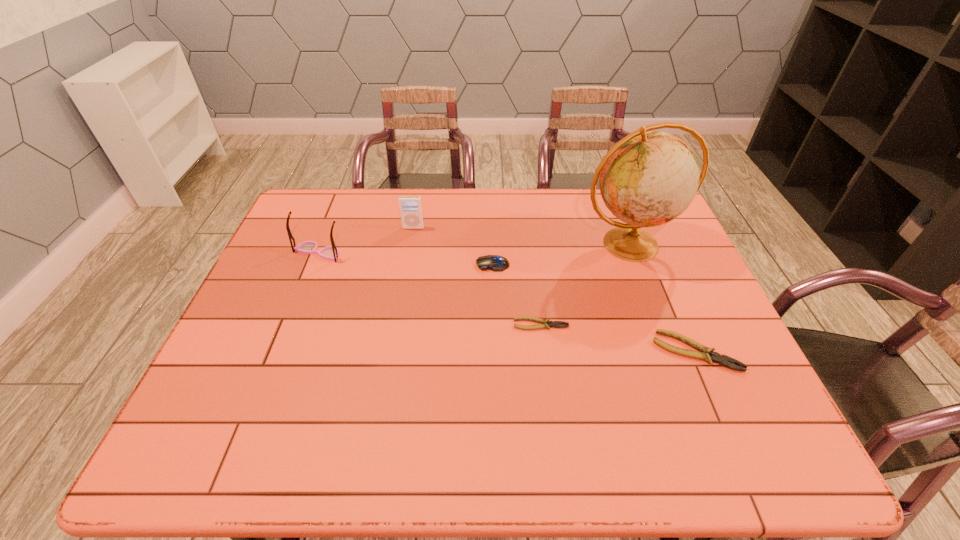
Identify the location of free area in between the computer mouse and the nearest object. The height and width of the screenshot is (540, 960). [x=594, y=308].

This screenshot has height=540, width=960. Identify the location of vacant space that is in between the third shortest object and the leftmost object. (406, 259).

Locate an element on the screen. This screenshot has width=960, height=540. free point between the fifth object from right to left and the shorter pliers is located at coordinates (477, 276).

Where is `free space that is in between the iPod and the computer mouse`? free space that is in between the iPod and the computer mouse is located at coordinates (453, 246).

At what (x,y) coordinates should I click in order to perform the action: click on free space between the taller pliers and the tallest object. Please return your answer as a coordinate pair (x, y). The width and height of the screenshot is (960, 540). Looking at the image, I should click on (663, 298).

At what (x,y) coordinates should I click in order to perform the action: click on object that stands as the fifth closest to the second object from left to right. Please return your answer as a coordinate pair (x, y). Image resolution: width=960 pixels, height=540 pixels. Looking at the image, I should click on (705, 352).

Identify the location of object that is the fifth closest one to the spectacles. (705, 352).

Where is `vacant space that satisfies the following two spatial constraints: 1. on the back side of the fifth farthest object; 2. on the left side of the tallest object`? vacant space that satisfies the following two spatial constraints: 1. on the back side of the fifth farthest object; 2. on the left side of the tallest object is located at coordinates (531, 245).

Find the location of `free location that satisfies the following two spatial constraints: 1. on the button side of the fourth tallest object; 2. on the back side of the fifth farthest object`. free location that satisfies the following two spatial constraints: 1. on the button side of the fourth tallest object; 2. on the back side of the fifth farthest object is located at coordinates tap(494, 324).

Find the location of a particular element. This screenshot has width=960, height=540. vacant area that satisfies the following two spatial constraints: 1. on the front-facing side of the left pliers; 2. on the right side of the fifth object from right to left is located at coordinates (396, 324).